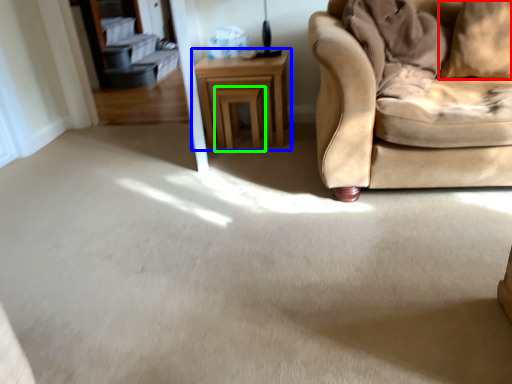
Question: Which object is positioned closest to pillow (highlighted by a red box)? Select from table (highlighted by a blue box) and stool (highlighted by a green box).

Choices:
 (A) table
 (B) stool

Answer: (A)